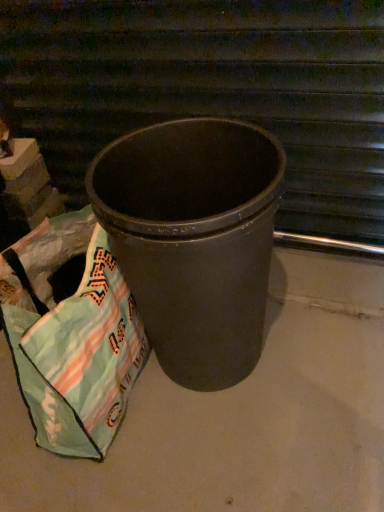
Question: From the image's perspective, would you say light green fabric bag at lower left is positioned over matte black trash can at center?

Choices:
 (A) no
 (B) yes

Answer: (A)

Question: Could you tell me if light green fabric bag at lower left is facing matte black trash can at center?

Choices:
 (A) no
 (B) yes

Answer: (A)

Question: Does light green fabric bag at lower left lie behind matte black trash can at center?

Choices:
 (A) yes
 (B) no

Answer: (B)

Question: Is light green fabric bag at lower left outside matte black trash can at center?

Choices:
 (A) no
 (B) yes

Answer: (B)

Question: Can you confirm if light green fabric bag at lower left is bigger than matte black trash can at center?

Choices:
 (A) yes
 (B) no

Answer: (B)

Question: Can you confirm if light green fabric bag at lower left is positioned to the left of matte black trash can at center?

Choices:
 (A) yes
 (B) no

Answer: (A)

Question: Can you confirm if matte gray concrete at center is positioned to the right of matte black trash can at center?

Choices:
 (A) no
 (B) yes

Answer: (A)

Question: Is matte gray concrete at center facing away from matte black trash can at center?

Choices:
 (A) yes
 (B) no

Answer: (A)

Question: Is matte gray concrete at center not inside matte black trash can at center?

Choices:
 (A) yes
 (B) no

Answer: (A)

Question: Is matte gray concrete at center at the left side of matte black trash can at center?

Choices:
 (A) yes
 (B) no

Answer: (A)

Question: Is matte gray concrete at center bigger than matte black trash can at center?

Choices:
 (A) yes
 (B) no

Answer: (A)

Question: Considering the relative positions of matte gray concrete at center and matte black trash can at center in the image provided, is matte gray concrete at center in front of matte black trash can at center?

Choices:
 (A) yes
 (B) no

Answer: (A)

Question: From a real-world perspective, is matte black trash can at center over light green fabric bag at lower left?

Choices:
 (A) yes
 (B) no

Answer: (A)